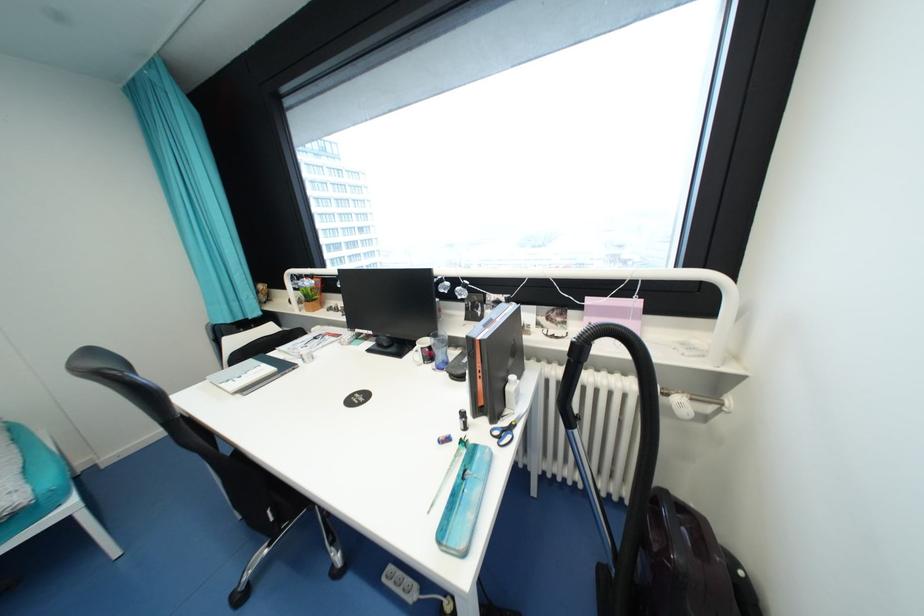
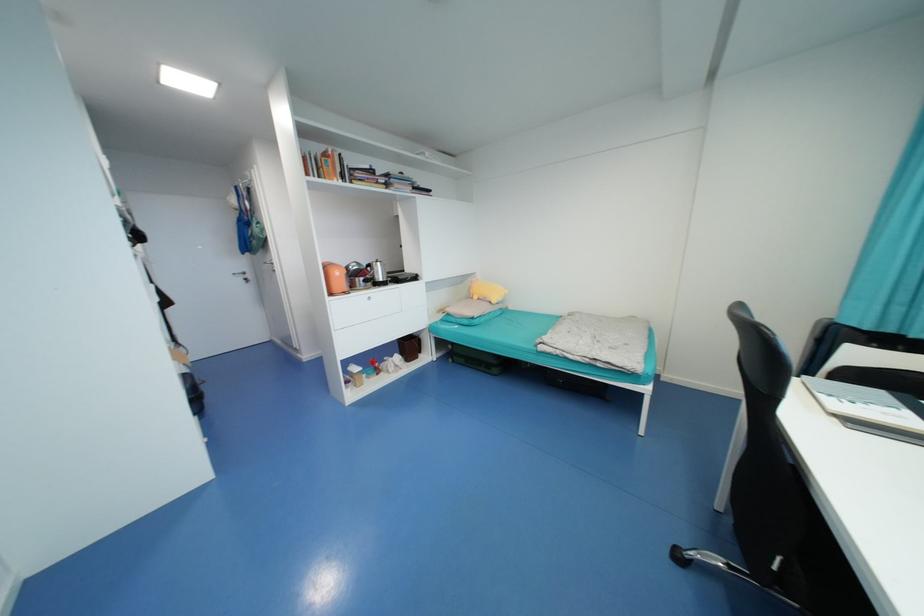
Based on the continuous images, in which direction is the camera rotating?

The camera's rotation is toward left-down.